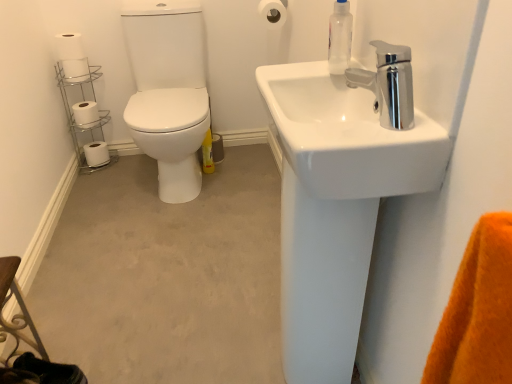
Question: Is chrome metallic faucet at upper right positioned behind transparent plastic soap dispenser at upper right?

Choices:
 (A) yes
 (B) no

Answer: (B)

Question: Does chrome metallic faucet at upper right have a larger size compared to transparent plastic soap dispenser at upper right?

Choices:
 (A) no
 (B) yes

Answer: (B)

Question: Is chrome metallic faucet at upper right directly adjacent to transparent plastic soap dispenser at upper right?

Choices:
 (A) yes
 (B) no

Answer: (B)

Question: Is chrome metallic faucet at upper right far away from transparent plastic soap dispenser at upper right?

Choices:
 (A) yes
 (B) no

Answer: (B)

Question: Is chrome metallic faucet at upper right facing away from transparent plastic soap dispenser at upper right?

Choices:
 (A) yes
 (B) no

Answer: (B)

Question: Is chrome metallic faucet at upper right at the left side of transparent plastic soap dispenser at upper right?

Choices:
 (A) no
 (B) yes

Answer: (A)

Question: Considering the relative sizes of white matte toilet paper at upper left, which ranks as the third toilet paper in right-to-left order, and chrome/metallic toilet paper holder at left in the image provided, is white matte toilet paper at upper left, which ranks as the third toilet paper in right-to-left order, bigger than chrome/metallic toilet paper holder at left?

Choices:
 (A) yes
 (B) no

Answer: (B)

Question: Is the position of white matte toilet paper at upper left, marked as the third toilet paper in a front-to-back arrangement, more distant than that of chrome/metallic toilet paper holder at left?

Choices:
 (A) no
 (B) yes

Answer: (A)

Question: From the image's perspective, is white matte toilet paper at upper left, placed as the 3th toilet paper when sorted from top to bottom, under chrome/metallic toilet paper holder at left?

Choices:
 (A) no
 (B) yes

Answer: (A)

Question: Is white matte toilet paper at upper left, the third toilet paper in the left-to-right sequence, to the right of chrome/metallic toilet paper holder at left from the viewer's perspective?

Choices:
 (A) no
 (B) yes

Answer: (A)

Question: Could you tell me if white matte toilet paper at upper left, the third toilet paper when ordered from back to front, is facing chrome/metallic toilet paper holder at left?

Choices:
 (A) no
 (B) yes

Answer: (A)

Question: From a real-world perspective, does white matte toilet paper at upper left, which is the 3th toilet paper in bottom-to-top order, stand above chrome/metallic toilet paper holder at left?

Choices:
 (A) yes
 (B) no

Answer: (A)

Question: From a real-world perspective, is transparent plastic soap dispenser at upper right over white glossy sink at upper right?

Choices:
 (A) no
 (B) yes

Answer: (B)